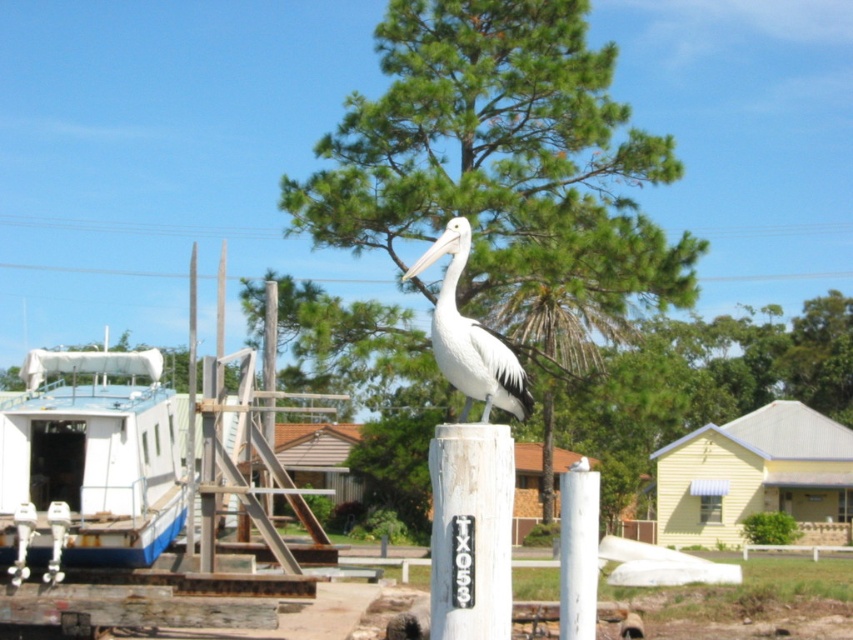
Does white wood post at center appear on the right side of white painted wood post at center?

In fact, white wood post at center is to the left of white painted wood post at center.

Is white wood post at center thinner than white painted wood post at center?

Indeed, white wood post at center has a lesser width compared to white painted wood post at center.

Between point (485, 452) and point (581, 496), which one is positioned behind?

Positioned behind is point (581, 496).

Locate an element on the screen. white wood post at center is located at coordinates (469, 531).

Is white wood post at center smaller than white matte pelican at center?

Yes, white wood post at center is smaller than white matte pelican at center.

Is point (480, 636) positioned in front of point (459, 369)?

Yes, it is in front of point (459, 369).

Locate an element on the screen. This screenshot has height=640, width=853. white wood post at center is located at coordinates (469, 531).

Measure the distance between point [512,352] and camera.

They are 27.14 meters apart.

Does white matte pelican at center appear on the right side of white painted wood post at center?

In fact, white matte pelican at center is to the left of white painted wood post at center.

Is point (456, 369) farther from viewer compared to point (563, 612)?

That is False.

This screenshot has height=640, width=853. What are the coordinates of `white matte pelican at center` in the screenshot? It's located at (469, 337).